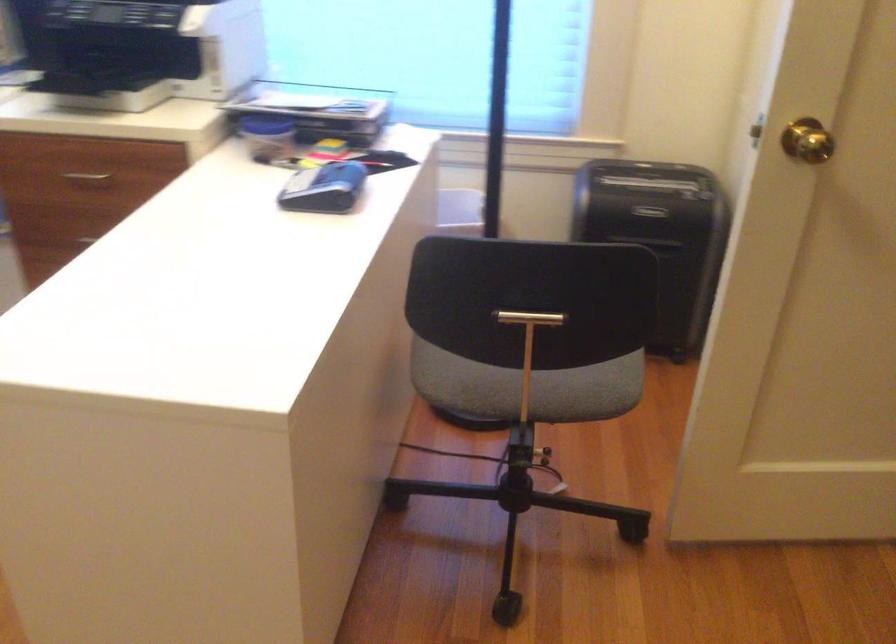
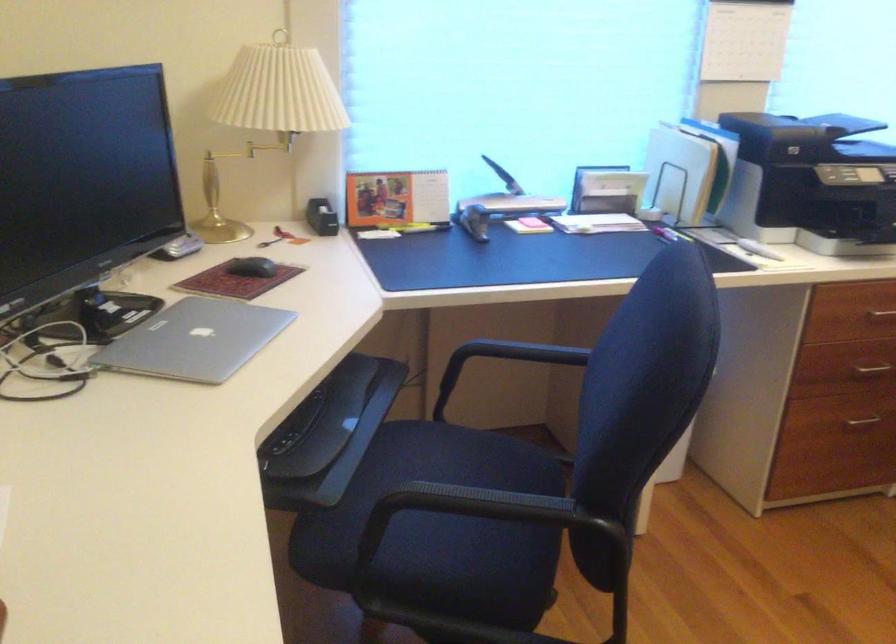
Where in the second image is the point corresponding to [83,182] from the first image?

(881, 315)